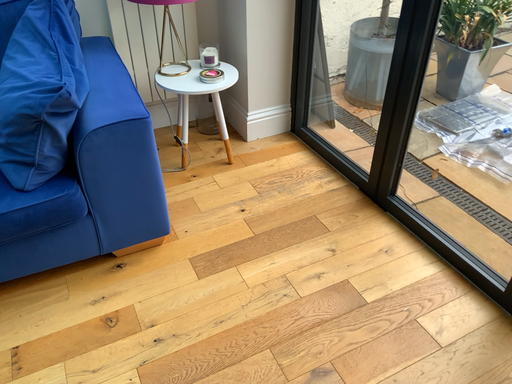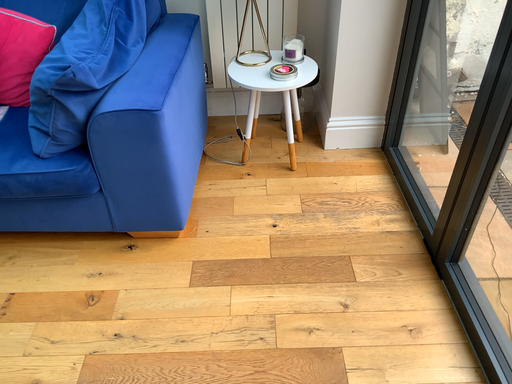
Question: Which way did the camera rotate in the video?

Choices:
 (A) rotated left
 (B) rotated right

Answer: (A)